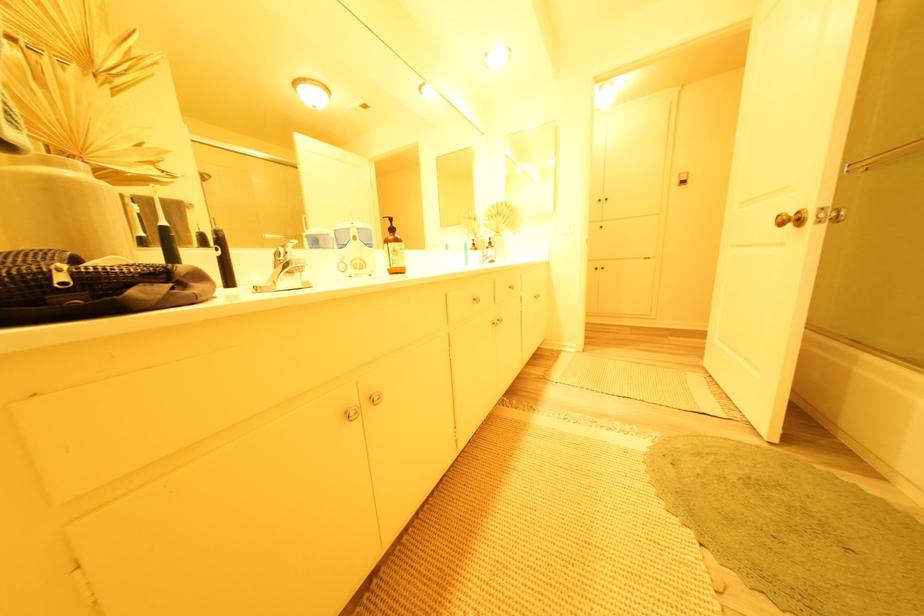
What do you see at coordinates (285, 270) in the screenshot?
I see `the silver faucet handle` at bounding box center [285, 270].